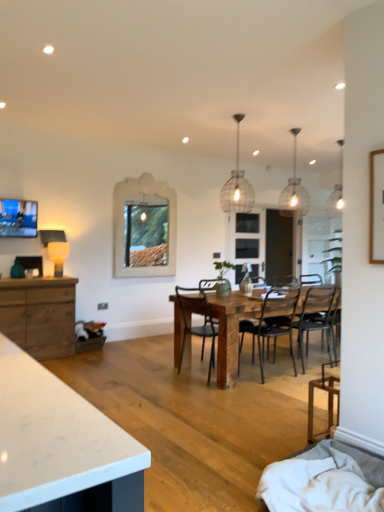
Question: Can you confirm if natural wood cabinet at left is thinner than wooden chair at lower right, the 4th chair in the back-to-front sequence?

Choices:
 (A) yes
 (B) no

Answer: (B)

Question: Is natural wood cabinet at left further to the viewer compared to wooden chair at lower right, the 1th chair when ordered from front to back?

Choices:
 (A) no
 (B) yes

Answer: (B)

Question: From the image's perspective, is natural wood cabinet at left under wooden chair at lower right, the 1th chair when ordered from front to back?

Choices:
 (A) no
 (B) yes

Answer: (A)

Question: Could you tell me if natural wood cabinet at left is facing wooden chair at lower right, the 1th chair when ordered from front to back?

Choices:
 (A) yes
 (B) no

Answer: (A)

Question: Is wooden chair at lower right, the 4th chair in the back-to-front sequence, surrounded by natural wood cabinet at left?

Choices:
 (A) yes
 (B) no

Answer: (B)

Question: Is natural wood cabinet at left oriented away from wooden chair at lower right, the 4th chair in the back-to-front sequence?

Choices:
 (A) yes
 (B) no

Answer: (B)

Question: Is the position of black metal chair at center, which ranks as the 4th chair in front-to-back order, less distant than that of matte glass pendant light at upper right, which is counted as the 3th light fixture, starting from the front?

Choices:
 (A) no
 (B) yes

Answer: (B)

Question: From a real-world perspective, is black metal chair at center, which ranks as the 4th chair in front-to-back order, under matte glass pendant light at upper right, which is counted as the 3th light fixture, starting from the front?

Choices:
 (A) yes
 (B) no

Answer: (A)

Question: Is black metal chair at center, which is the 1th chair from back to front, aimed at matte glass pendant light at upper right, which is the third light fixture from left to right?

Choices:
 (A) yes
 (B) no

Answer: (B)

Question: Considering the relative positions of black metal chair at center, which is the 1th chair from back to front, and matte glass pendant light at upper right, positioned as the first light fixture in back-to-front order, in the image provided, is black metal chair at center, which is the 1th chair from back to front, to the right of matte glass pendant light at upper right, positioned as the first light fixture in back-to-front order, from the viewer's perspective?

Choices:
 (A) yes
 (B) no

Answer: (B)

Question: Does black metal chair at center, which is the 1th chair from back to front, lie behind matte glass pendant light at upper right, which is the third light fixture from left to right?

Choices:
 (A) no
 (B) yes

Answer: (A)

Question: Does black metal chair at center, which ranks as the 4th chair in front-to-back order, have a lesser height compared to matte glass pendant light at upper right, positioned as the first light fixture in back-to-front order?

Choices:
 (A) no
 (B) yes

Answer: (B)

Question: From a real-world perspective, is black metal chair at center, which appears as the 3th chair when viewed from the front, physically above woven wire pendant light at center, which is the 1th light fixture in front-to-back order?

Choices:
 (A) no
 (B) yes

Answer: (A)